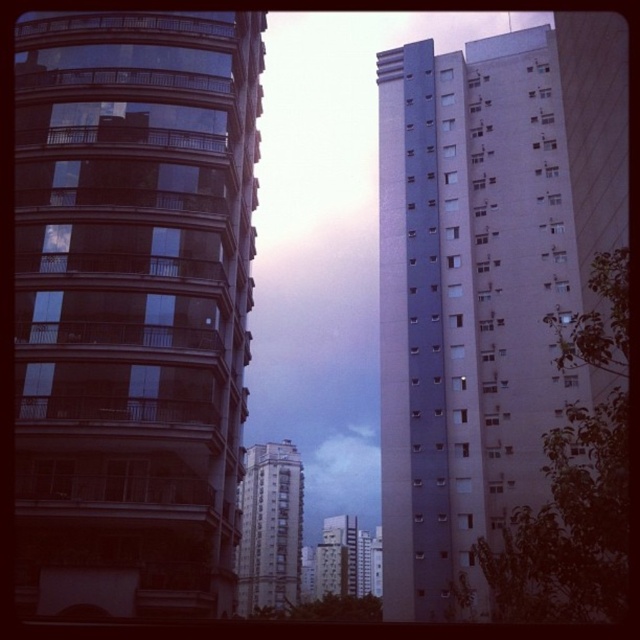
Question: Where is light gray concrete building at right located in relation to white concrete building at center in the image?

Choices:
 (A) below
 (B) above

Answer: (B)

Question: Considering the real-world distances, which object is closest to the light gray concrete building at right?

Choices:
 (A) white smooth building at center
 (B) white concrete building at center

Answer: (B)

Question: Can you confirm if white concrete building at center is bigger than white smooth building at center?

Choices:
 (A) no
 (B) yes

Answer: (B)

Question: Can you confirm if light gray concrete building at right is positioned below white concrete building at center?

Choices:
 (A) no
 (B) yes

Answer: (A)

Question: Which object appears closest to the camera in this image?

Choices:
 (A) white smooth building at center
 (B) white concrete building at center

Answer: (B)

Question: Which object is closer to the camera taking this photo?

Choices:
 (A) light gray concrete building at right
 (B) glassy reflective building at left

Answer: (A)